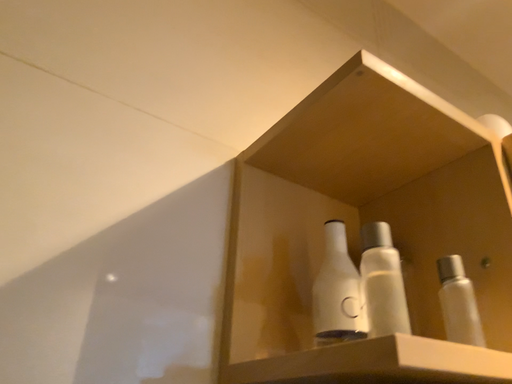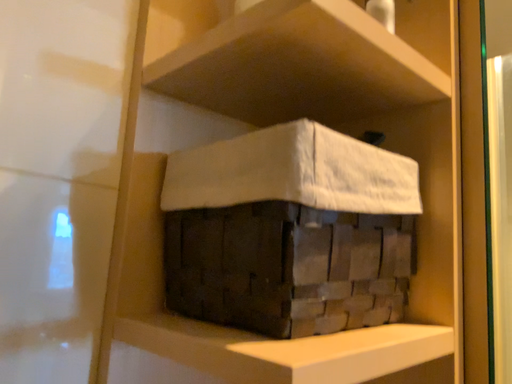
Question: How did the camera likely rotate when shooting the video?

Choices:
 (A) rotated downward
 (B) rotated upward

Answer: (A)